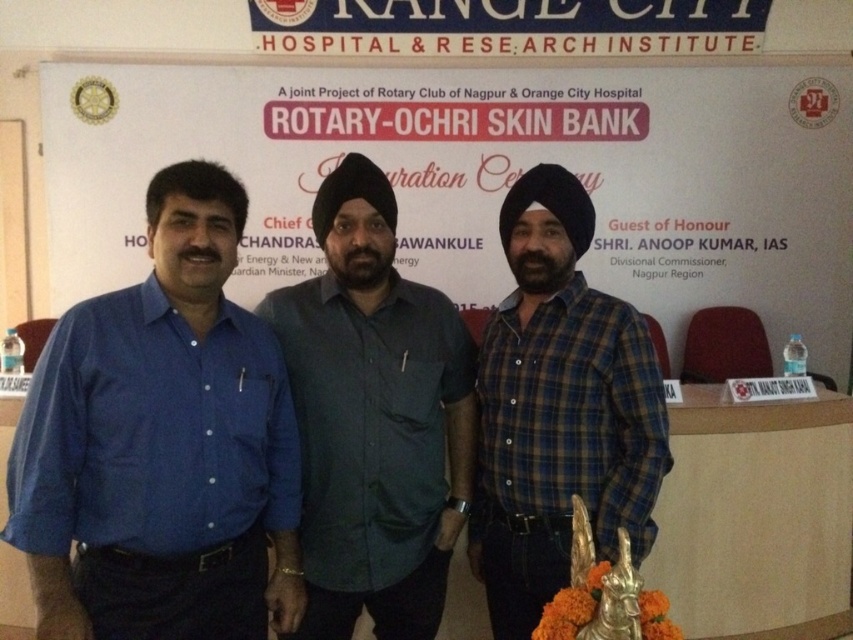
You are a photographer setting up for a group photo. You need to ensure that the distance between the matte blue shirt at left and the blue plaid shirt at center is at least 30 inches to frame them properly. Based on the scene description, will this distance requirement be met?

The matte blue shirt at left and blue plaid shirt at center are 30.15 inches apart from each other, which exceeds the required 30 inches. Therefore, the distance requirement is met.

You are organizing a presentation and need to know which object occupies more horizontal space in the image. Based on the scene, which one is wider between the white paper at center and the dark grey shirt at center?

The white paper at center is wider than the dark grey shirt at center according to the description.